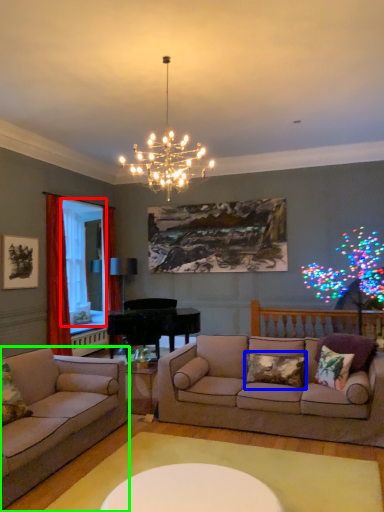
Question: Based on their relative distances, which object is farther from window screen (highlighted by a red box)? Choose from pillow (highlighted by a blue box) and studio couch (highlighted by a green box).

Choices:
 (A) pillow
 (B) studio couch

Answer: (A)